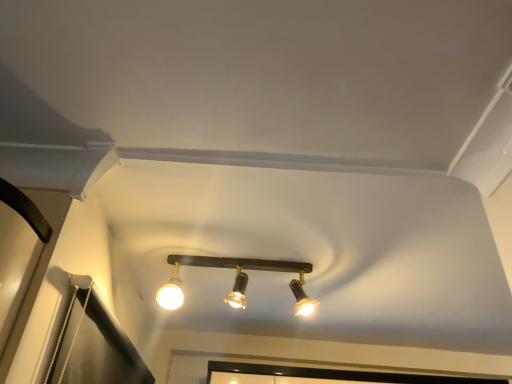
Identify the location of matte black track light at center. (234, 279).

The image size is (512, 384). Describe the element at coordinates (234, 279) in the screenshot. I see `matte black track light at center` at that location.

Find the location of `matte black track light at center`. matte black track light at center is located at coordinates (234, 279).